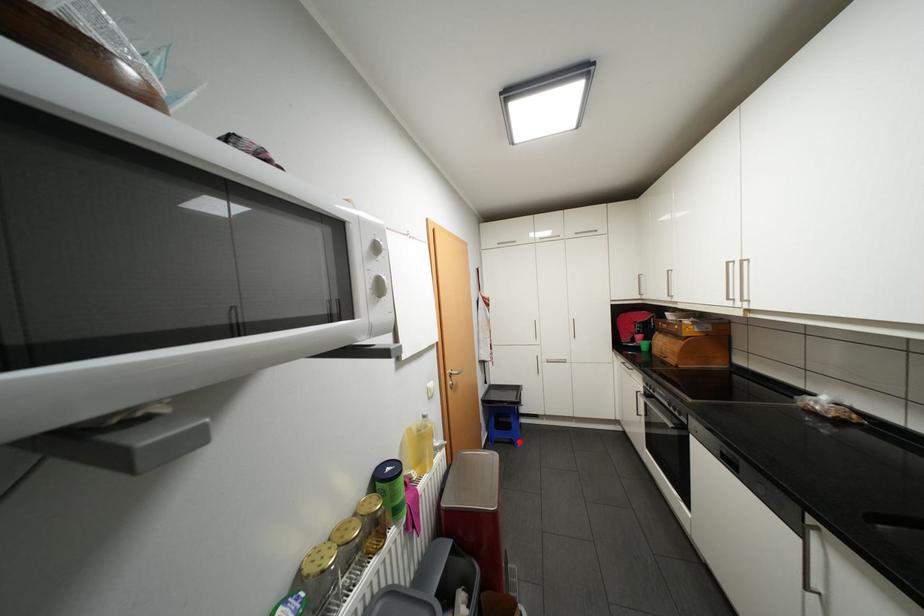
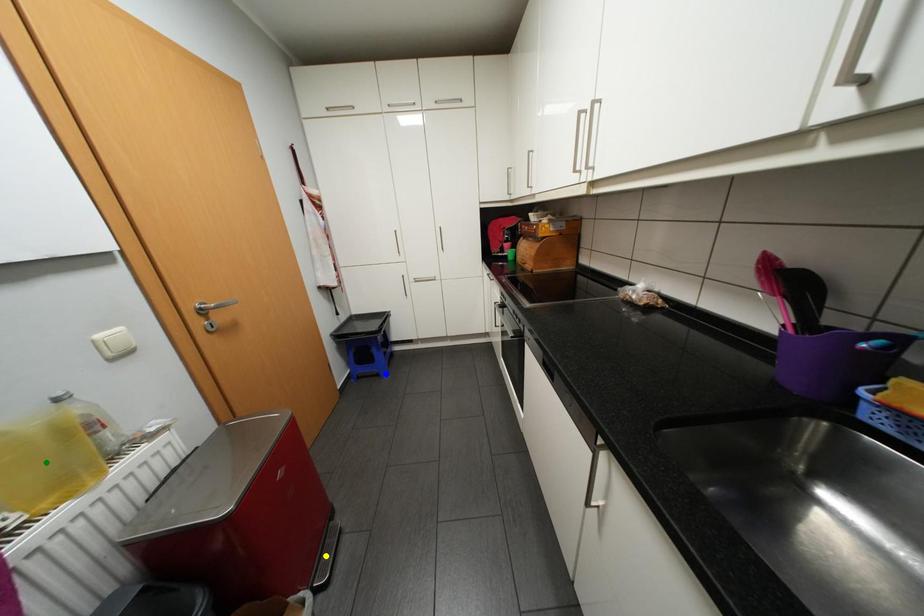
Question: I am providing you with two images of the same scene from different viewpoints. A red point is marked on the first image. You are given multiple points on the second image. Which mark in image 2 goes with the point in image 1?

Choices:
 (A) yellow point
 (B) green point
 (C) blue point

Answer: (C)